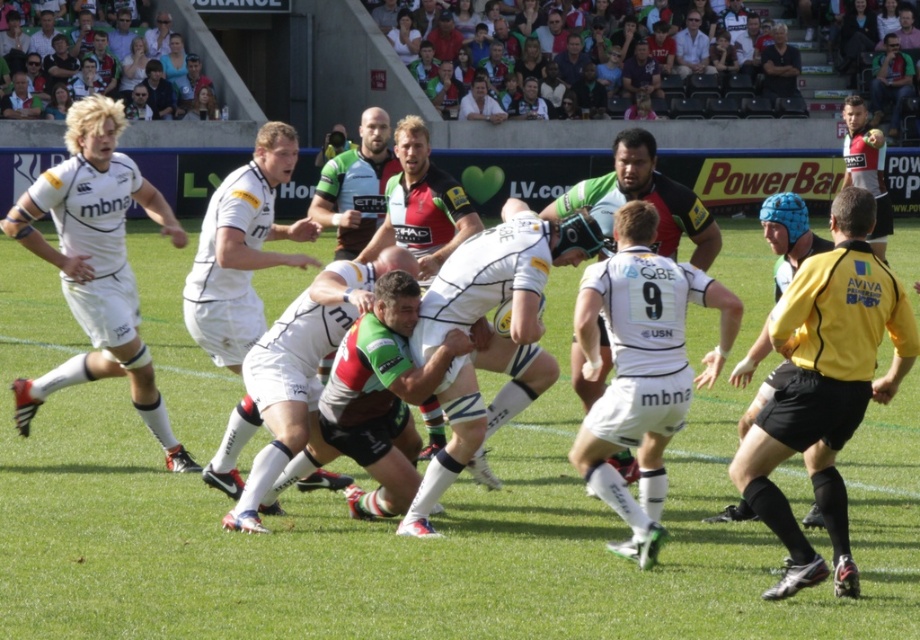
Is camouflage-patterned shorts at center positioned at the back of green jersey at center?

No, it is in front of green jersey at center.

In the scene shown: Does camouflage-patterned shorts at center have a larger size compared to green jersey at center?

Yes.

Is point (302, 387) farther from viewer compared to point (351, 257)?

No, (302, 387) is in front of (351, 257).

You are a GUI agent. You are given a task and a screenshot of the screen. Output one action in this format:
    pyautogui.click(x=<x>, y=<y>)
    Task: Click on the camouflage-patterned shorts at center
    
    Given the screenshot: What is the action you would take?
    pyautogui.click(x=302, y=368)

Between green grass football field at center and white shirt at upper center, which one has less height?

Standing shorter between the two is white shirt at upper center.

Where is `green grass football field at center`? green grass football field at center is located at coordinates (431, 518).

Is point (167, 520) less distant than point (693, 20)?

Yes, it is in front of point (693, 20).

In order to click on green grass football field at center in this screenshot , I will do `click(431, 518)`.

Can you confirm if white matte jersey at center is taller than green jersey at center?

Yes, white matte jersey at center is taller than green jersey at center.

Locate an element on the screen. The width and height of the screenshot is (920, 640). white matte jersey at center is located at coordinates (240, 250).